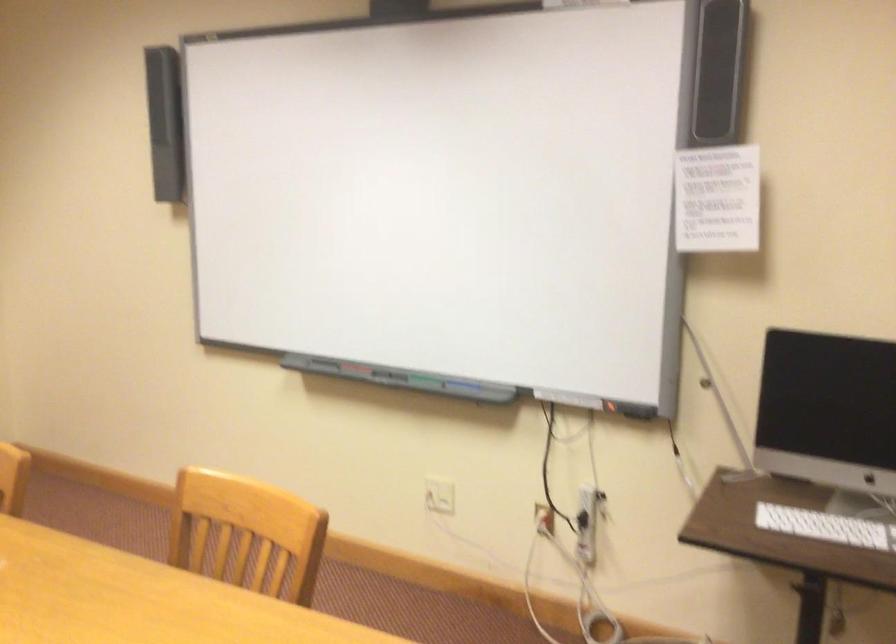
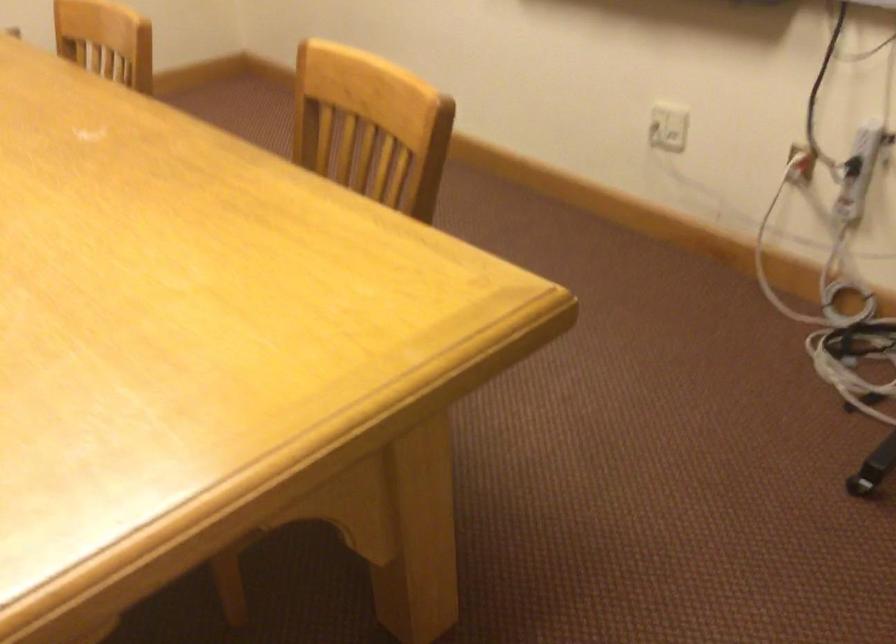
First-person continuous shooting, in which direction is the camera rotating?

The camera rotated toward left-down.